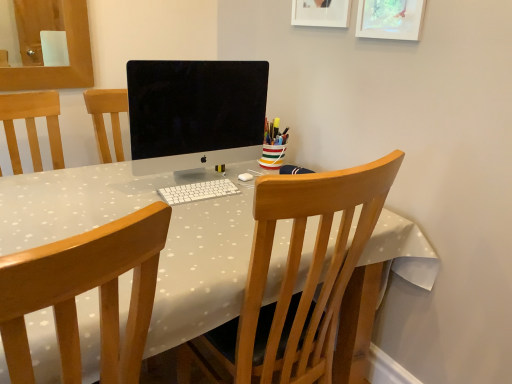
Question: Is white matte picture frame at upper center, arranged as the 1th picture frame when viewed from the left, looking in the opposite direction of matte white picture frame at upper right, which is counted as the 1th picture frame, starting from the right?

Choices:
 (A) yes
 (B) no

Answer: (B)

Question: Can you confirm if white matte picture frame at upper center, the second picture frame positioned from the right, is bigger than matte white picture frame at upper right, which is counted as the 1th picture frame, starting from the right?

Choices:
 (A) no
 (B) yes

Answer: (B)

Question: From a real-world perspective, is white matte picture frame at upper center, arranged as the 1th picture frame when viewed from the left, located beneath matte white picture frame at upper right, the 2th picture frame positioned from the left?

Choices:
 (A) yes
 (B) no

Answer: (B)

Question: Considering the relative positions of white matte picture frame at upper center, arranged as the 1th picture frame when viewed from the left, and matte white picture frame at upper right, the 2th picture frame positioned from the left, in the image provided, is white matte picture frame at upper center, arranged as the 1th picture frame when viewed from the left, behind matte white picture frame at upper right, the 2th picture frame positioned from the left,?

Choices:
 (A) yes
 (B) no

Answer: (A)

Question: From a real-world perspective, is white matte picture frame at upper center, arranged as the 1th picture frame when viewed from the left, on matte white picture frame at upper right, the 2th picture frame positioned from the left?

Choices:
 (A) no
 (B) yes

Answer: (B)

Question: Is white matte picture frame at upper center, arranged as the 1th picture frame when viewed from the left, outside matte white picture frame at upper right, which is counted as the 1th picture frame, starting from the right?

Choices:
 (A) no
 (B) yes

Answer: (B)

Question: From the image's perspective, is striped ceramic cup at center on top of wooden chair at center, the first chair viewed from the right?

Choices:
 (A) no
 (B) yes

Answer: (B)

Question: Is striped ceramic cup at center outside wooden chair at center, the 2th chair positioned from the left?

Choices:
 (A) no
 (B) yes

Answer: (B)

Question: Does striped ceramic cup at center appear on the left side of wooden chair at center, the first chair viewed from the right?

Choices:
 (A) yes
 (B) no

Answer: (B)

Question: Is striped ceramic cup at center bigger than wooden chair at center, the first chair viewed from the right?

Choices:
 (A) yes
 (B) no

Answer: (B)

Question: Does striped ceramic cup at center lie in front of wooden chair at center, the 2th chair positioned from the left?

Choices:
 (A) no
 (B) yes

Answer: (A)

Question: Can you confirm if striped ceramic cup at center is smaller than wooden chair at center, the first chair viewed from the right?

Choices:
 (A) no
 (B) yes

Answer: (B)

Question: Is wooden chair at center, the first chair viewed from the right, wider than wooden chair at center, the second chair when ordered from right to left?

Choices:
 (A) no
 (B) yes

Answer: (B)